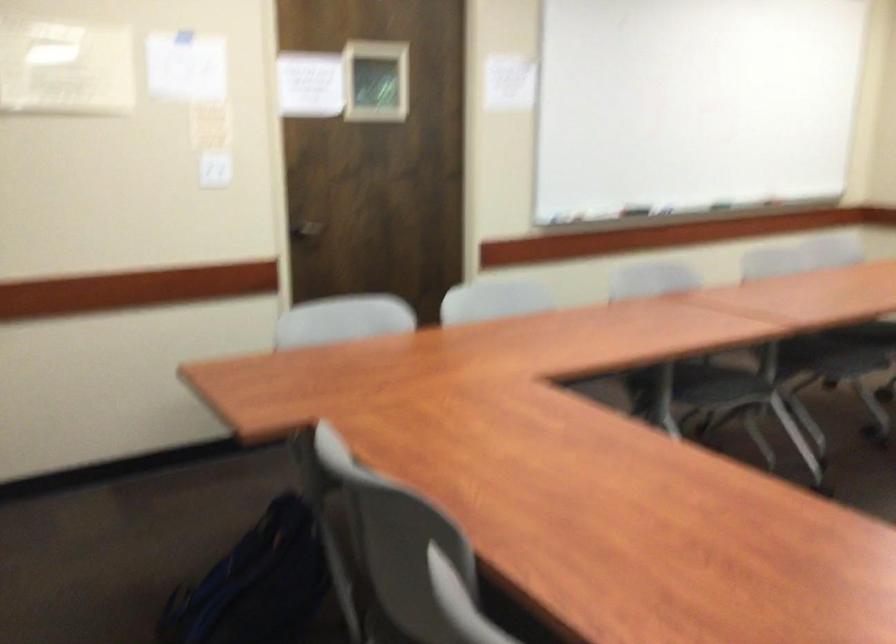
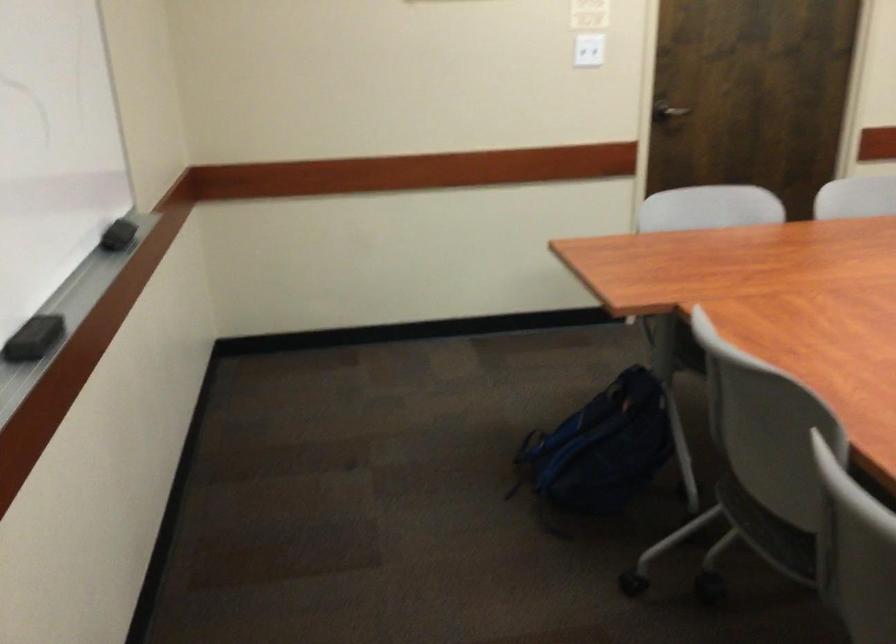
The point at (209,172) is marked in the first image. Where is the corresponding point in the second image?

(588, 51)